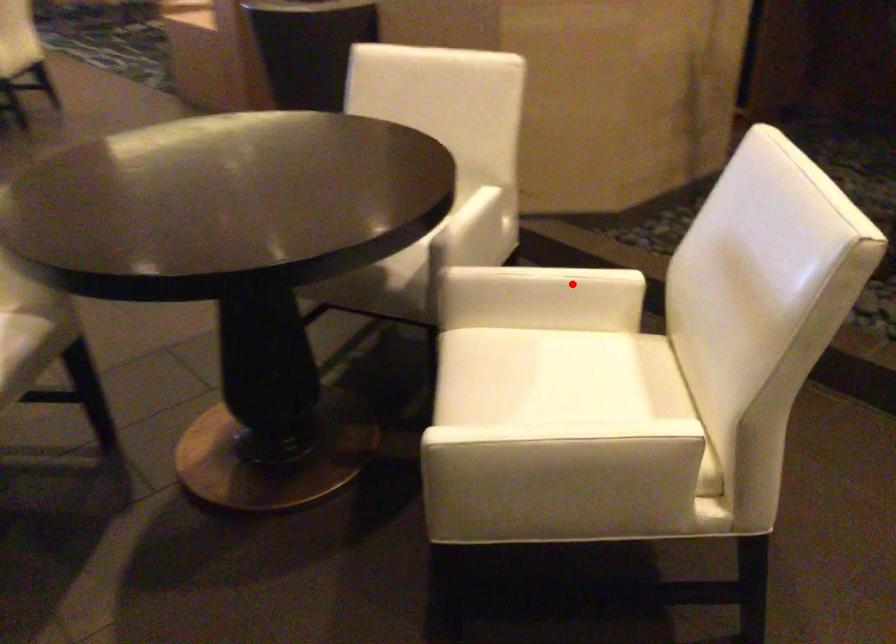
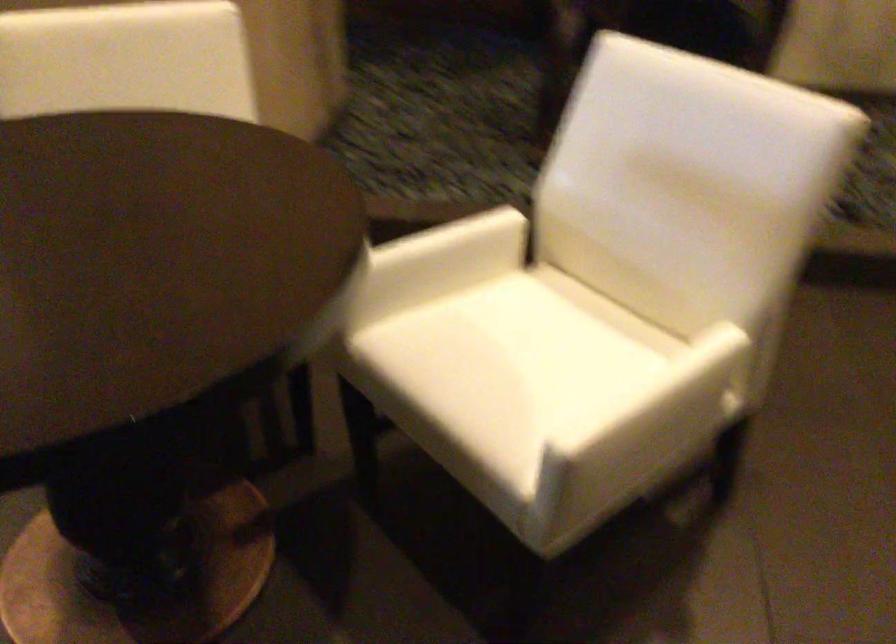
Find the pixel in the second image that matches the highlighted location in the first image.

(468, 239)